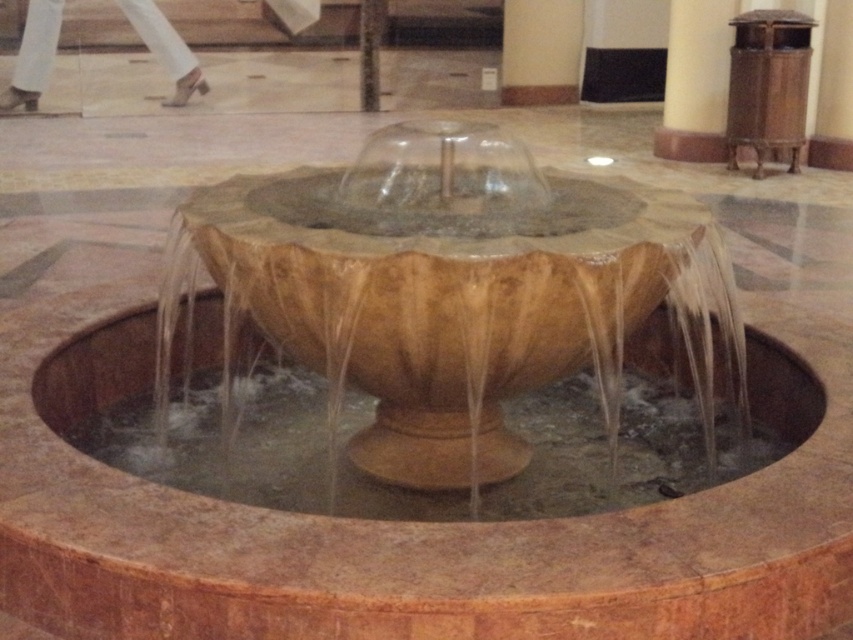
In the scene shown: You are standing at the entrance of the indoor space and want to walk directly to the brown stone fountain at center. According to the coordinates provided, what are the coordinates you need to aim for?

The coordinates you need to aim for are 0.473 on the x axis and 0.533 on the y axis, as the brown stone fountain at center is located at point (454,301).

You are standing in front of the fountain and want to place a decorative item between the smooth beige pillar at upper center and the smooth stone pillar at center. Which direction should you move to place it between them?

The smooth beige pillar at upper center is to the right of the smooth stone pillar at center, so you should move to the right of the smooth stone pillar at center to place the decorative item between them.